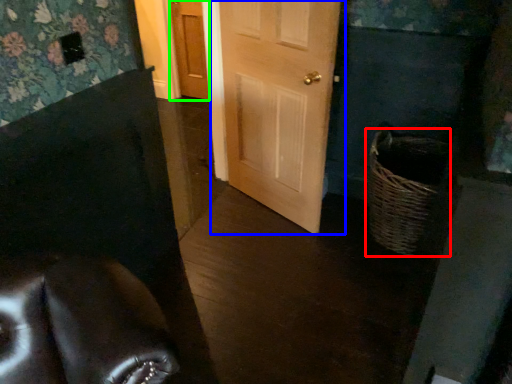
Question: Which object is positioned closest to basket (highlighted by a red box)? Select from door (highlighted by a blue box) and door (highlighted by a green box).

Choices:
 (A) door
 (B) door

Answer: (A)